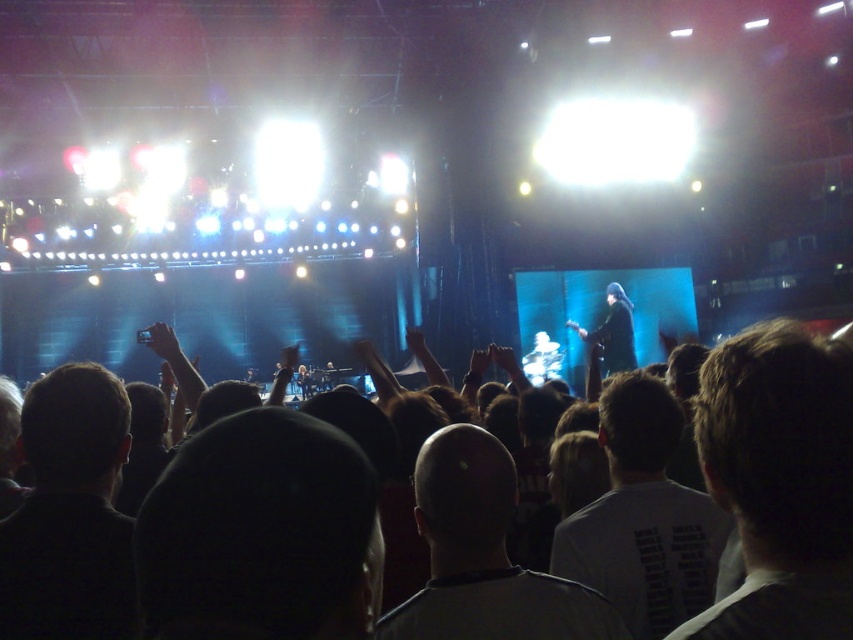
Consider the image. You are a photographer at the concert. You want to take a photo of the dark hair at center and bald head at center so that both are clearly visible. Which object should you focus on first to ensure the other is also in focus?

You should focus on the dark hair at center first because it is larger in size than the bald head at center, ensuring the bald head at center will also be in focus.

You are a stagehand holding a 1.5 meter ladder. You need to place it between the dark hair at center and the bald head at center to reach a light fixture above them. Will the ladder fit between them?

The distance between dark hair at center and bald head at center is 1.58 meters. Since the ladder is 1.5 meters, it will fit as it is shorter than the distance between them.